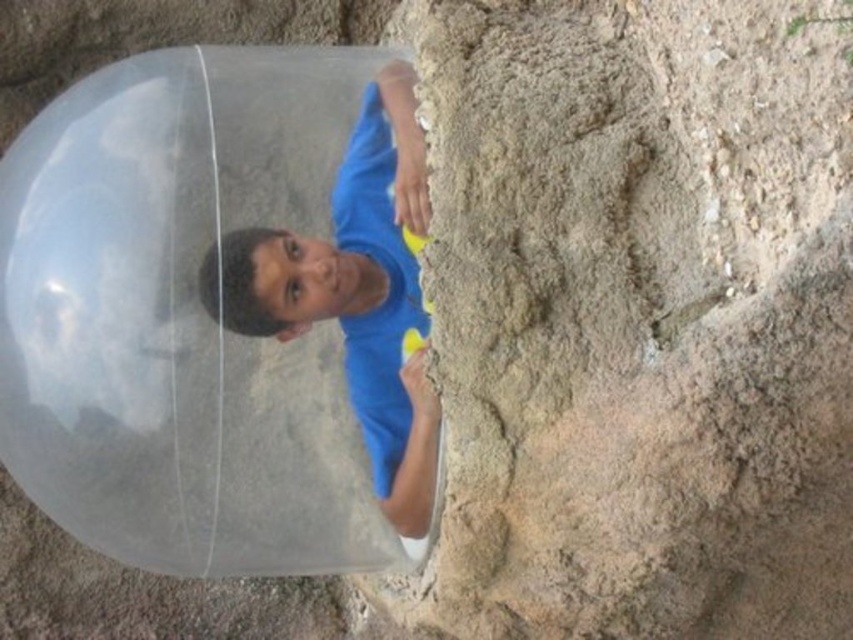
You are a lifeguard on duty at the beach. You notice a person trapped inside the transparent plastic bubble at center and wearing the blue matte shirt at center. Based on their current position, can you determine if the person is fully enclosed within the bubble or if part of their body is visible outside?

The transparent plastic bubble at center is located below blue matte shirt at center, meaning the shirt is above the bubble. This indicates that the person wearing the blue matte shirt at center has their upper body visible outside the bubble, while their lower body is enclosed inside.

You are a lifeguard at the beach and see the transparent plastic bubble at center and the blue matte shirt at center. Which object is closer to you, the observer?

The transparent plastic bubble at center is closer to you because the blue matte shirt at center is behind it.